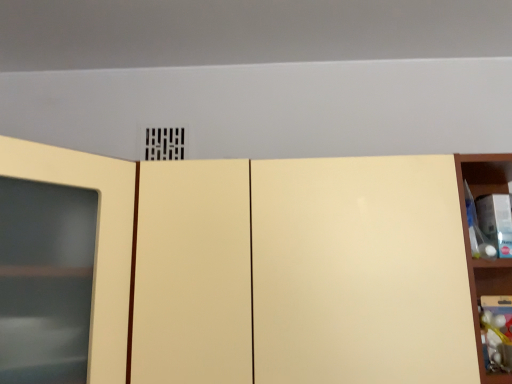
Find the location of a particular element. The width and height of the screenshot is (512, 384). matte wood shelf at right is located at coordinates (470, 247).

The width and height of the screenshot is (512, 384). Describe the element at coordinates (470, 247) in the screenshot. I see `matte wood shelf at right` at that location.

Find the location of a particular element. This screenshot has width=512, height=384. matte yellow cabinet at center is located at coordinates (243, 266).

What is the approximate width of matte yellow cabinet at center?

matte yellow cabinet at center is 22.45 inches wide.

The height and width of the screenshot is (384, 512). What do you see at coordinates (243, 266) in the screenshot?
I see `matte yellow cabinet at center` at bounding box center [243, 266].

Locate an element on the screen. The width and height of the screenshot is (512, 384). matte wood shelf at right is located at coordinates click(470, 247).

Which is more to the left, matte yellow cabinet at center or matte wood shelf at right?

Positioned to the left is matte yellow cabinet at center.

From the picture: Relative to matte wood shelf at right, is matte yellow cabinet at center in front or behind?

Visually, matte yellow cabinet at center is located in front of matte wood shelf at right.

Which is closer, [379,182] or [508,382]?

The point [379,182] is closer to the camera.

From the image's perspective, between matte yellow cabinet at center and matte wood shelf at right, who is located below?

matte wood shelf at right, from the image's perspective.

From a real-world perspective, between matte yellow cabinet at center and matte wood shelf at right, who is vertically higher?

matte yellow cabinet at center, from a real-world perspective.

Which object is wider, matte yellow cabinet at center or matte wood shelf at right?

Wider between the two is matte yellow cabinet at center.

Who is taller, matte yellow cabinet at center or matte wood shelf at right?

matte wood shelf at right.

Who is smaller, matte yellow cabinet at center or matte wood shelf at right?

matte wood shelf at right is smaller.

Is matte wood shelf at right located within matte yellow cabinet at center?

Definitely not — matte wood shelf at right is not inside matte yellow cabinet at center.

Is matte yellow cabinet at center beside matte wood shelf at right?

matte yellow cabinet at center and matte wood shelf at right are not in contact.

Is matte yellow cabinet at center aimed at matte wood shelf at right?

No, matte yellow cabinet at center is not aimed at matte wood shelf at right.

At what (x,y) coordinates should I click in order to perform the action: click on cupboard above the matte wood shelf at right (from a real-world perspective). Please return your answer as a coordinate pair (x, y). Looking at the image, I should click on (243, 266).

Is matte wood shelf at right at the right side of matte yellow cabinet at center?

Yes.

In the image, is matte wood shelf at right positioned in front of or behind matte yellow cabinet at center?

In the image, matte wood shelf at right appears behind matte yellow cabinet at center.

Considering the positions of point (474, 323) and point (168, 268), is point (474, 323) closer or farther from the camera than point (168, 268)?

Point (474, 323).

From the image's perspective, relative to matte yellow cabinet at center, is matte wood shelf at right above or below?

matte wood shelf at right is situated lower than matte yellow cabinet at center in the image.

From a real-world perspective, relative to matte yellow cabinet at center, is matte wood shelf at right vertically above or below?

In terms of real-world spatial position, matte wood shelf at right is below matte yellow cabinet at center.

Considering the relative sizes of matte wood shelf at right and matte yellow cabinet at center in the image provided, is matte wood shelf at right thinner than matte yellow cabinet at center?

Correct, the width of matte wood shelf at right is less than that of matte yellow cabinet at center.

Between matte wood shelf at right and matte yellow cabinet at center, which one has more height?

matte wood shelf at right.

Considering the relative sizes of matte wood shelf at right and matte yellow cabinet at center in the image provided, is matte wood shelf at right bigger than matte yellow cabinet at center?

No, matte wood shelf at right is not bigger than matte yellow cabinet at center.

Based on the photo, can we say matte wood shelf at right lies outside matte yellow cabinet at center?

Yes, matte wood shelf at right is outside of matte yellow cabinet at center.

Is matte wood shelf at right beside matte yellow cabinet at center?

There is a gap between matte wood shelf at right and matte yellow cabinet at center.

Is matte wood shelf at right oriented towards matte yellow cabinet at center?

No.

Measure the distance between matte wood shelf at right and matte yellow cabinet at center.

A distance of 15.87 inches exists between matte wood shelf at right and matte yellow cabinet at center.

Find the location of a particular element. The image size is (512, 384). shelf that appears below the matte yellow cabinet at center (from a real-world perspective) is located at coordinates (470, 247).

The width and height of the screenshot is (512, 384). I want to click on shelf that appears behind the matte yellow cabinet at center, so click(470, 247).

Where is `cupboard in front of the matte wood shelf at right`? The width and height of the screenshot is (512, 384). cupboard in front of the matte wood shelf at right is located at coordinates (243, 266).